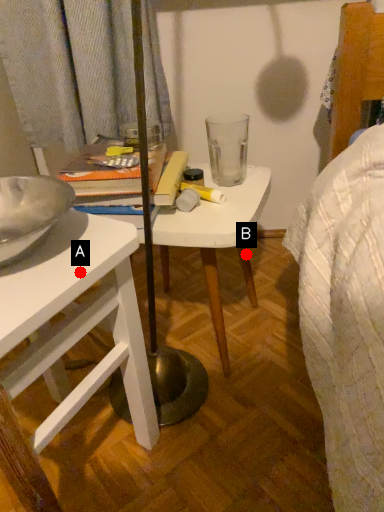
Question: Two points are circled on the image, labeled by A and B beside each circle. Which point appears farthest from the camera in this image?

Choices:
 (A) A is further
 (B) B is further

Answer: (B)